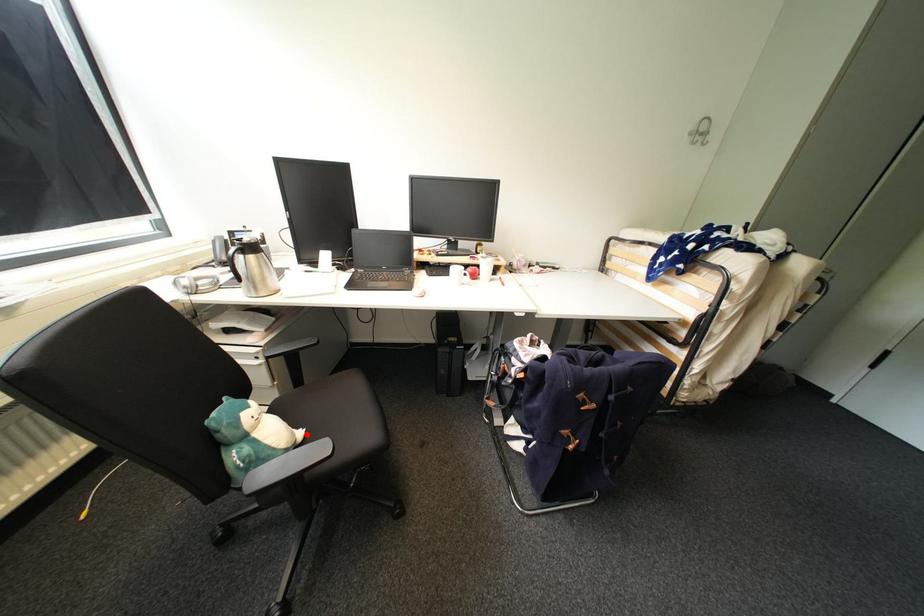
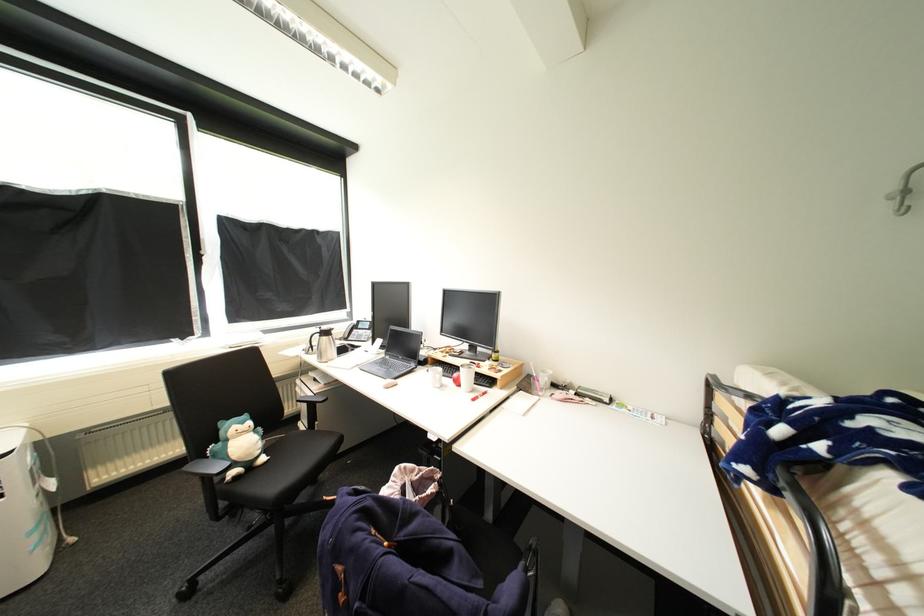
Question: I am providing you with two images of the same scene from different viewpoints. Given a red point in image1, look at the same physical point in image2. Is it:

Choices:
 (A) Closer to the viewpoint
 (B) Farther from the viewpoint

Answer: (A)